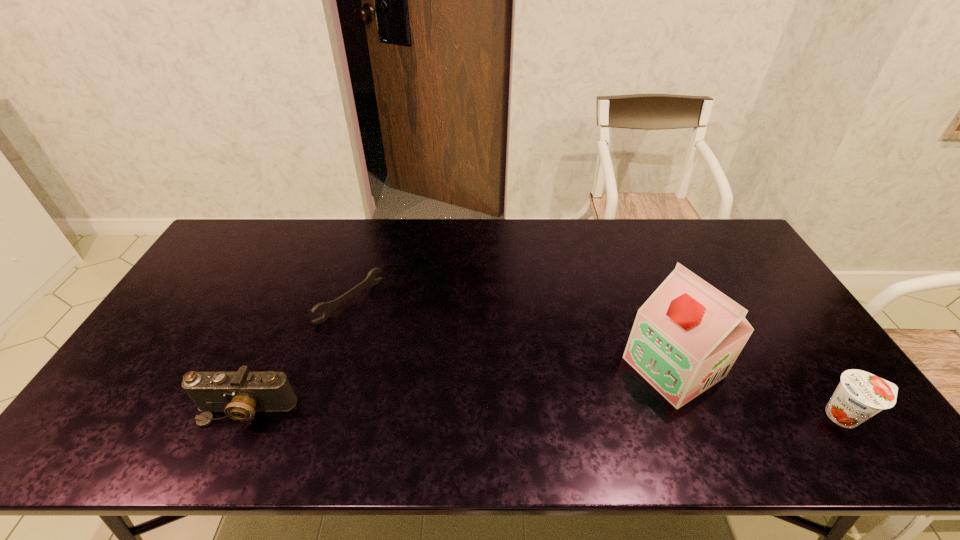
The image size is (960, 540). Identify the location of vacant space located 0.130m with the cap open on the soya milk. (601, 411).

What are the coordinates of `camera that is positioned at the near edge` in the screenshot? It's located at (240, 394).

The image size is (960, 540). I want to click on yogurt located at the near edge, so click(860, 395).

The image size is (960, 540). Identify the location of soya milk that is at the near edge. (686, 337).

Identify the location of object located in the right edge section of the desktop. (860, 395).

The height and width of the screenshot is (540, 960). What are the coordinates of `object that is at the near right corner` in the screenshot? It's located at (860, 395).

You are a GUI agent. You are given a task and a screenshot of the screen. Output one action in this format:
    pyautogui.click(x=<x>, y=<y>)
    Task: Click on the free space at the far edge of the desktop
    Image resolution: width=960 pixels, height=540 pixels.
    Given the screenshot: What is the action you would take?
    pyautogui.click(x=667, y=240)

The height and width of the screenshot is (540, 960). In the image, there is a desktop. Identify the location of free region at the left edge. (159, 373).

Image resolution: width=960 pixels, height=540 pixels. Identify the location of vacant space at the right edge of the desktop. (779, 344).

The height and width of the screenshot is (540, 960). In order to click on free space that is in between the yogurt and the farthest object in this screenshot , I will do `click(598, 359)`.